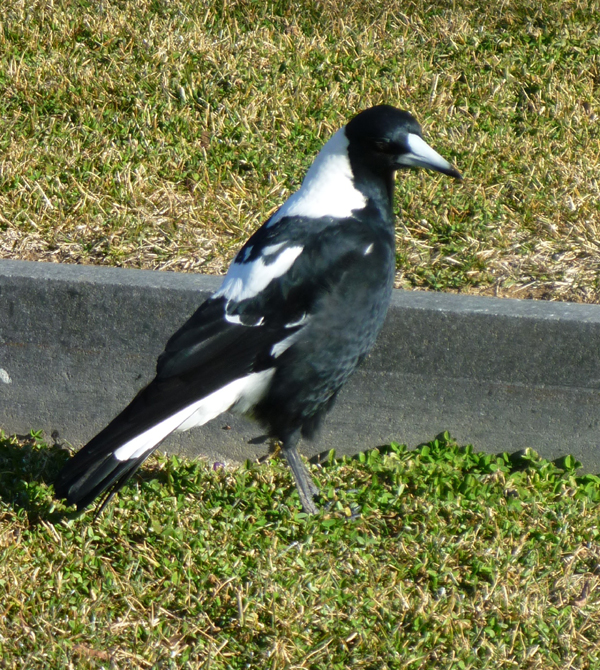
Where is `wall`? This screenshot has width=600, height=670. wall is located at coordinates (468, 356).